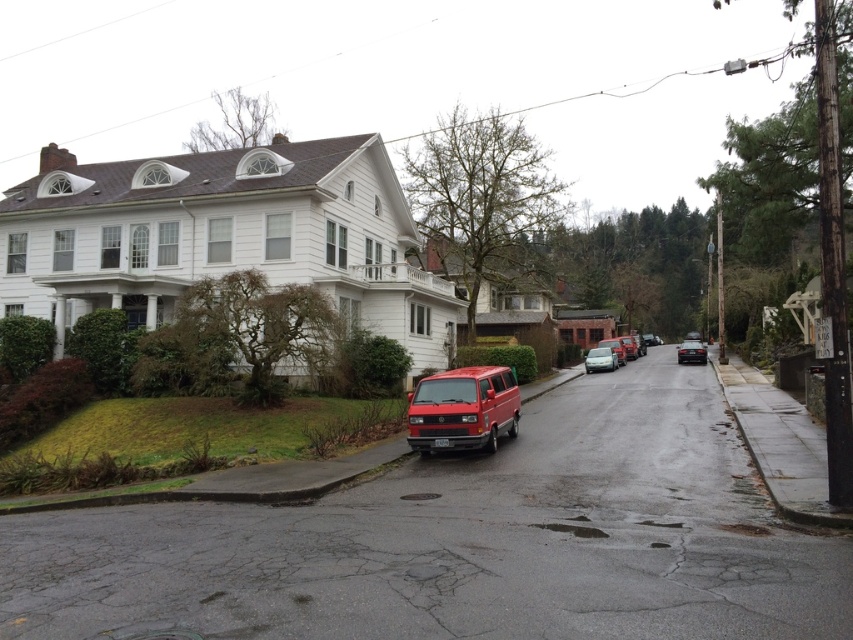
You are standing at the point labeled as point (463, 410) in the image. Which object are you touching? Please answer with the object label from the Objects list.

The point (463, 410) is on the matte red van at center, so you are touching the matte red van at center.

Based on the photo, you are a delivery driver who needs to park your vehicle in a space that can accommodate your vehicle height. You see a matte red van at center and a metallic silver sedan at center. Which vehicle has a greater height and should be considered for parking in taller spaces?

The matte red van at center is much taller than the metallic silver sedan at center, so it should be considered for parking in taller spaces.